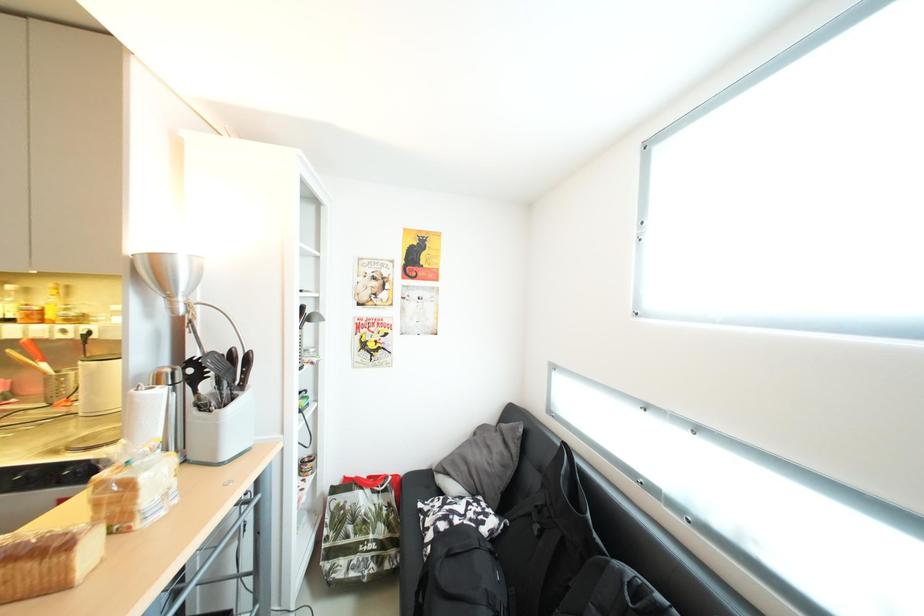
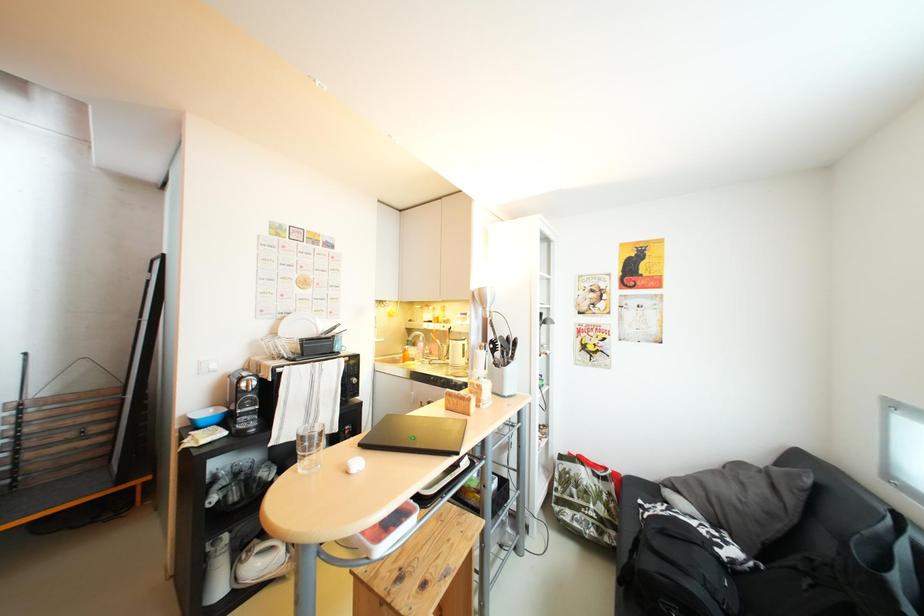
Question: The camera is either moving clockwise (left) or counter-clockwise (right) around the object. The first image is from the beginning of the video and the second image is from the end. Is the camera moving left or right when shooting the video?

Choices:
 (A) Left
 (B) Right

Answer: (B)